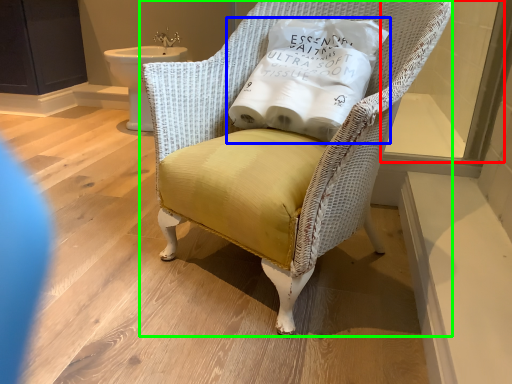
Question: Based on their relative distances, which object is nearer to window (highlighted by a red box)? Choose from pillow (highlighted by a blue box) and chair (highlighted by a green box).

Choices:
 (A) pillow
 (B) chair

Answer: (A)